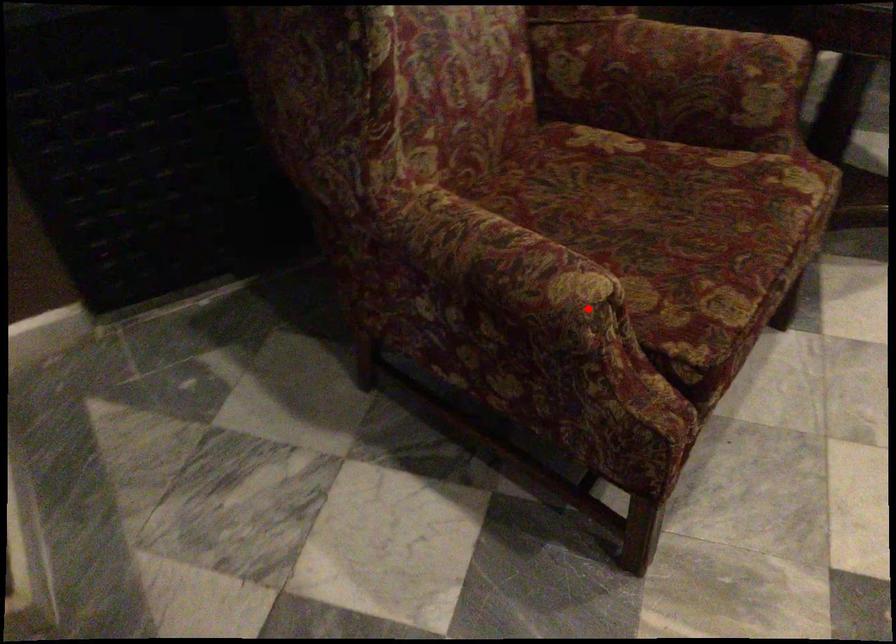
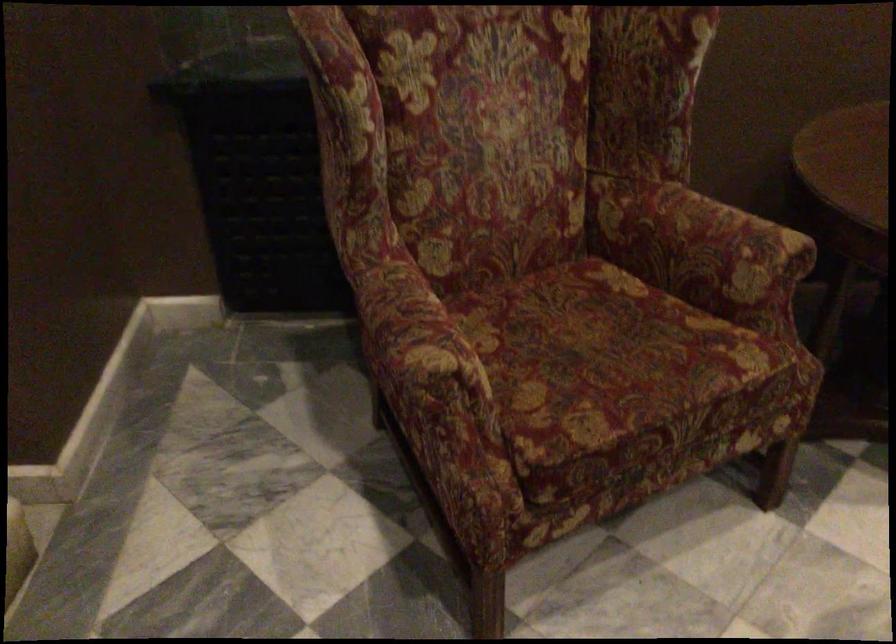
Locate, in the second image, the point that corresponds to the highlighted location in the first image.

(428, 377)